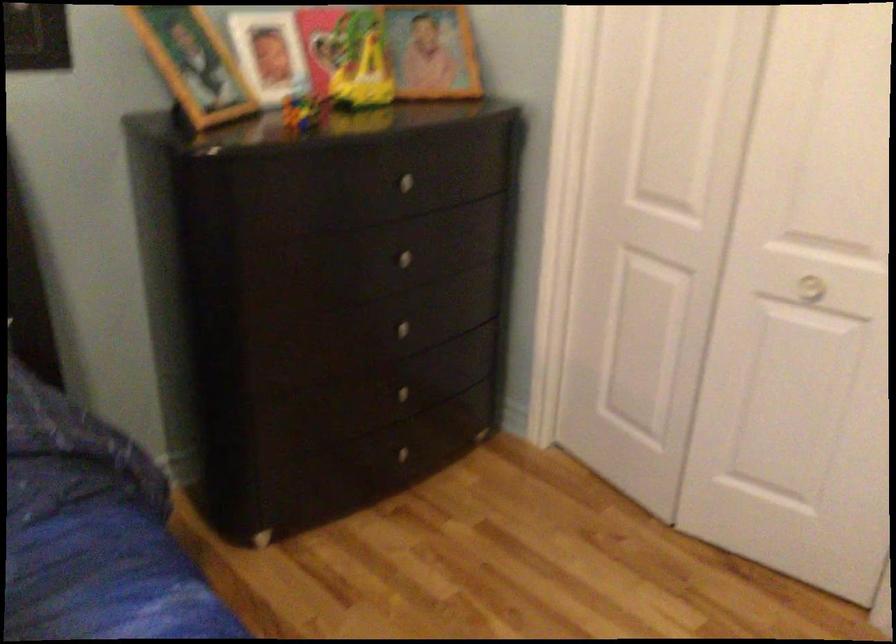
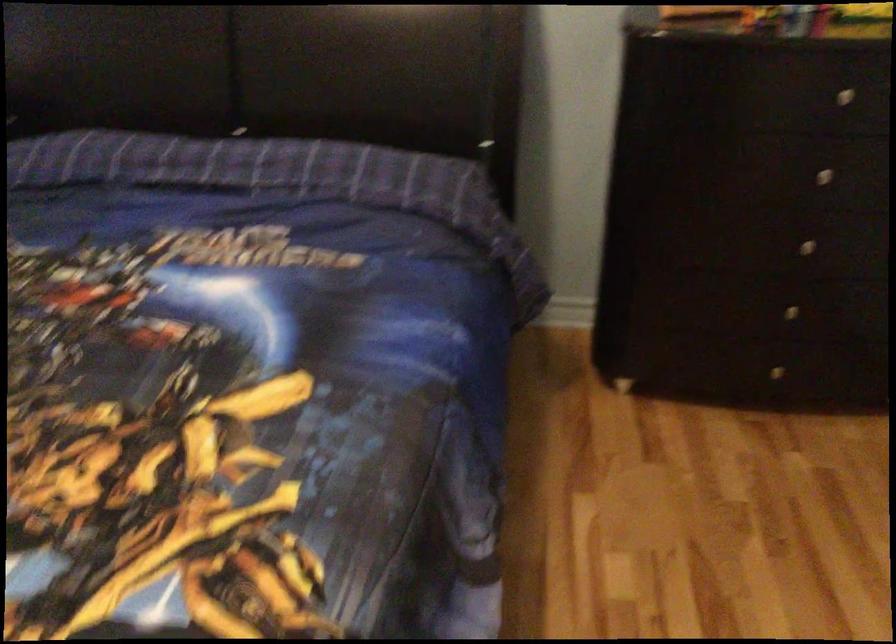
Locate, in the second image, the point that corresponds to pixel 414 176 in the first image.

(858, 91)